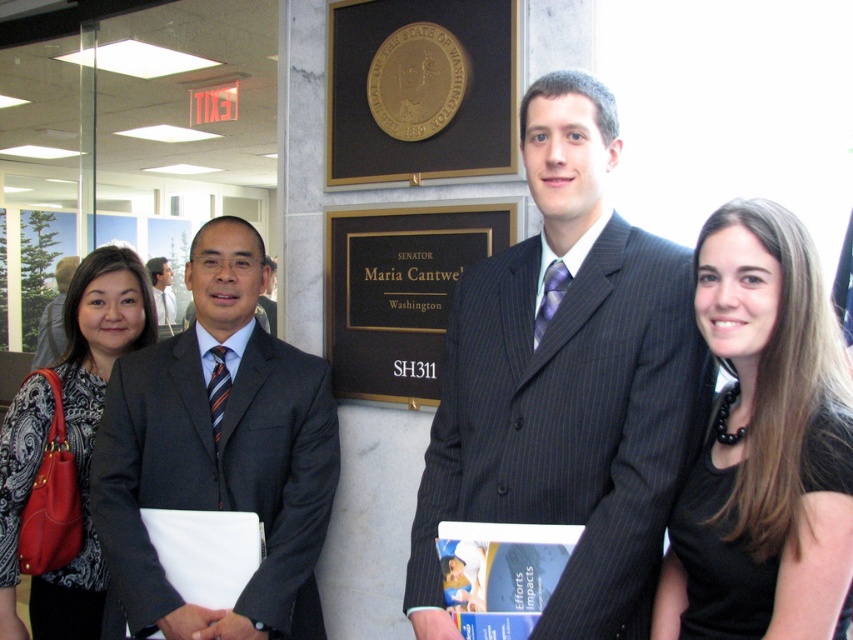
Based on the photo, you are a photographer adjusting the camera settings to ensure all subjects are in focus. The camera has a depth of field range of 1.5 meters. Given the distance between the black matte shirt at center and the patterned fabric blouse at left, will both subjects be in focus?

The black matte shirt at center is 1.57 meters away from the patterned fabric blouse at left. Since the camera has a depth of field range of 1.5 meters, the distance between them exceeds this range, so not all subjects will be in focus.

You are standing at the point marked as point (775, 339). You want to walk to the nearest exit, which is 4.51 feet away. Is there enough space to walk straight without any obstacles?

Yes, there is enough space to walk straight to the nearest exit since the distance between you and the exit is 4.51 feet, and there are no obstacles mentioned in the scene description.

In the scene, there is a black matte shirt at center represented by point (764,444). Where is this point located in relation to the marble wall with plaques?

The point (764,444) representing the black matte shirt at center is located in front of the marble wall with plaques.